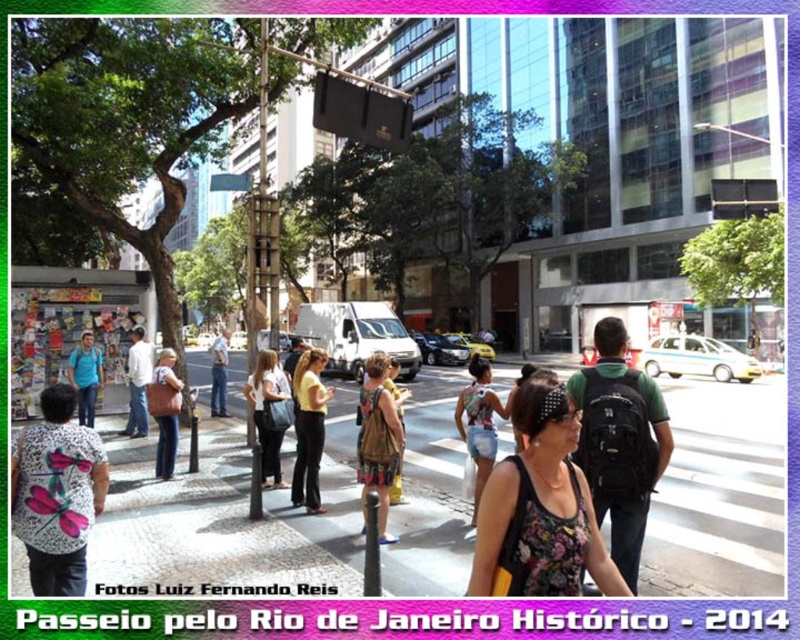
Question: Considering the relative positions of floral fabric top at center and matte black pants at center in the image provided, where is floral fabric top at center located with respect to matte black pants at center?

Choices:
 (A) below
 (B) above

Answer: (A)

Question: Is white printed shirt at center closer to camera compared to matte blue shirt at left?

Choices:
 (A) no
 (B) yes

Answer: (B)

Question: Among these objects, which one is farthest from the camera?

Choices:
 (A) matte brown bag at center
 (B) floral fabric top at center

Answer: (A)

Question: Among these points, which one is nearest to the camera?

Choices:
 (A) (625, 500)
 (B) (174, 458)
 (C) (78, 352)

Answer: (A)

Question: Estimate the real-world distances between objects in this image. Which object is closer to the white shirt at center?

Choices:
 (A) light blue jeans at center
 (B) brown canvas bag at center

Answer: (A)

Question: Observing the image, what is the correct spatial positioning of floral fabric tank top at center in reference to black backpack at center?

Choices:
 (A) above
 (B) below

Answer: (A)